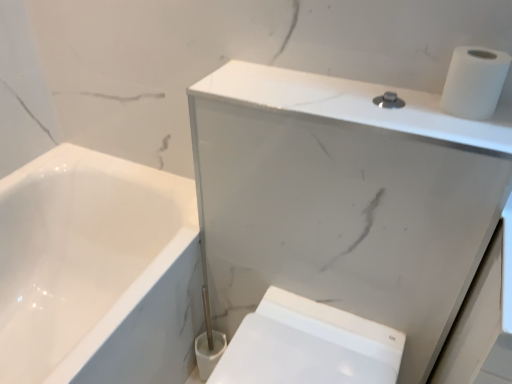
Question: From the image's perspective, is white matte toilet paper at upper right located above white marble cabinet at upper right?

Choices:
 (A) yes
 (B) no

Answer: (A)

Question: Is the surface of white matte toilet paper at upper right in direct contact with white marble cabinet at upper right?

Choices:
 (A) no
 (B) yes

Answer: (A)

Question: Is white marble cabinet at upper right a part of white matte toilet paper at upper right?

Choices:
 (A) yes
 (B) no

Answer: (B)

Question: From the image's perspective, is white matte toilet paper at upper right below white marble cabinet at upper right?

Choices:
 (A) yes
 (B) no

Answer: (B)

Question: Are white matte toilet paper at upper right and white marble cabinet at upper right far apart?

Choices:
 (A) yes
 (B) no

Answer: (B)

Question: Is white matte toilet paper at upper right thinner than white marble cabinet at upper right?

Choices:
 (A) yes
 (B) no

Answer: (A)

Question: Could you tell me if white marble cabinet at upper right is turned towards white matte toilet paper at upper right?

Choices:
 (A) no
 (B) yes

Answer: (A)

Question: Does white marble cabinet at upper right contain white matte toilet paper at upper right?

Choices:
 (A) no
 (B) yes

Answer: (A)

Question: From a real-world perspective, is white marble cabinet at upper right on white matte toilet paper at upper right?

Choices:
 (A) no
 (B) yes

Answer: (A)

Question: Is white marble cabinet at upper right further to the viewer compared to white matte toilet paper at upper right?

Choices:
 (A) no
 (B) yes

Answer: (A)

Question: Is white marble cabinet at upper right directly adjacent to white matte toilet paper at upper right?

Choices:
 (A) yes
 (B) no

Answer: (B)

Question: From a real-world perspective, is white marble cabinet at upper right physically below white matte toilet paper at upper right?

Choices:
 (A) no
 (B) yes

Answer: (B)

Question: Is white marble cabinet at upper right behind white glossy bidet at lower right?

Choices:
 (A) yes
 (B) no

Answer: (B)